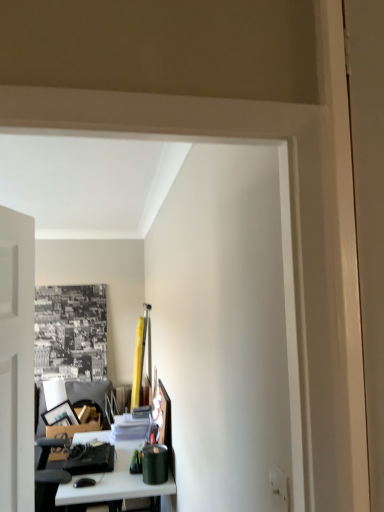
Find the location of a particular element. The width and height of the screenshot is (384, 512). free location to the left of green matte canister at lower center, acting as the 2th stationery starting from the left is located at coordinates (129, 479).